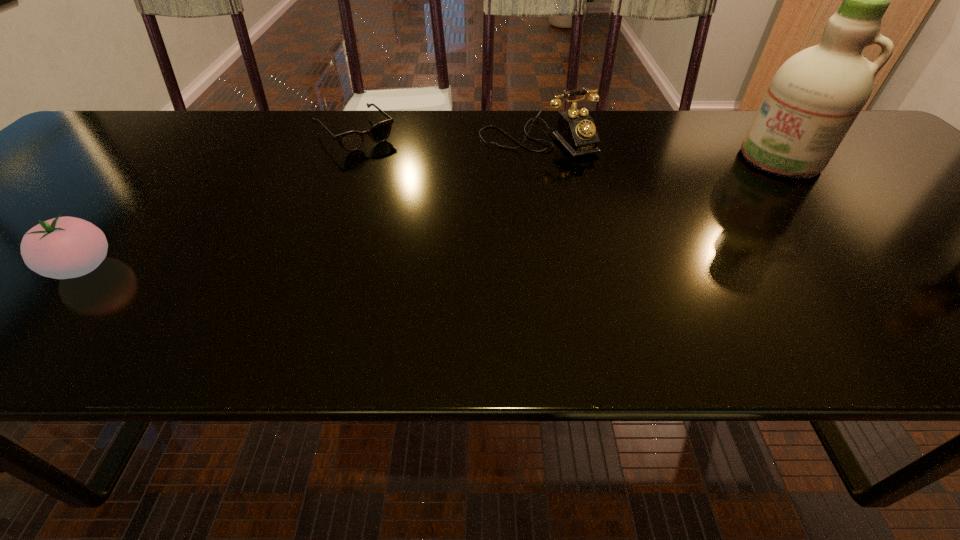
This screenshot has width=960, height=540. I want to click on the leftmost object, so click(x=63, y=247).

This screenshot has height=540, width=960. In order to click on the second shortest object in this screenshot , I will do `click(63, 247)`.

Locate an element on the screen. the rightmost object is located at coordinates (814, 98).

Identify the location of the tallest object. (814, 98).

At what (x,y) coordinates should I click in order to perform the action: click on the second object from right to left. Please return your answer as a coordinate pair (x, y). Looking at the image, I should click on tap(576, 131).

The width and height of the screenshot is (960, 540). Identify the location of the second tallest object. (576, 131).

Find the location of a particular element. The width and height of the screenshot is (960, 540). the shortest object is located at coordinates (351, 141).

At what (x,y) coordinates should I click in order to perform the action: click on sunglasses. Please return your answer as a coordinate pair (x, y). The width and height of the screenshot is (960, 540). Looking at the image, I should click on pos(351,141).

I want to click on free location located 0.400m on the back of the tomato, so click(x=195, y=142).

Identify the location of blank area located 0.280m on the front label of the tallest object. (709, 226).